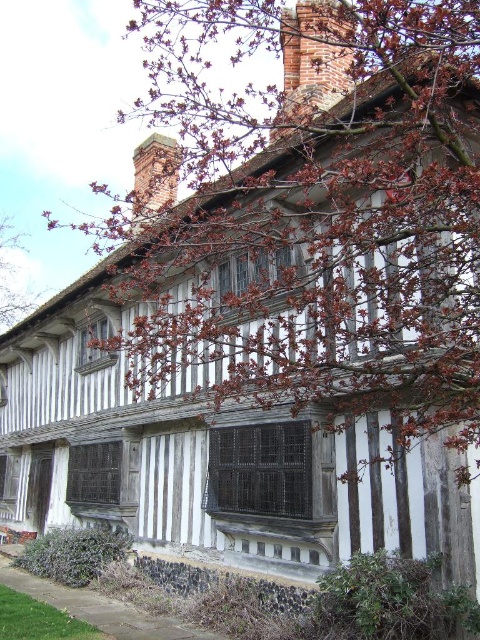
Does brown wood tree at upper center have a lesser height compared to brown textured tree at upper left?

Incorrect, brown wood tree at upper center's height does not fall short of brown textured tree at upper left's.

Does brown wood tree at upper center appear under brown textured tree at upper left?

No.

I want to click on brown wood tree at upper center, so click(316, 216).

Consider the image. How much distance is there between brown wood tree at upper center and red brick chimney at upper center?

brown wood tree at upper center is 15.93 meters from red brick chimney at upper center.

Between point (430, 429) and point (312, 32), which one is positioned in front?

Point (430, 429)

At what (x,y) coordinates should I click in order to perform the action: click on brown wood tree at upper center. Please return your answer as a coordinate pair (x, y). Image resolution: width=480 pixels, height=640 pixels. Looking at the image, I should click on (x=316, y=216).

Who is more distant from viewer, [336,68] or [21,252]?

The point [21,252] is behind.

Describe the element at coordinates (312, 58) in the screenshot. I see `red brick chimney at upper center` at that location.

This screenshot has width=480, height=640. Describe the element at coordinates (312, 58) in the screenshot. I see `red brick chimney at upper center` at that location.

Locate an element on the screen. This screenshot has height=640, width=480. red brick chimney at upper center is located at coordinates (312, 58).